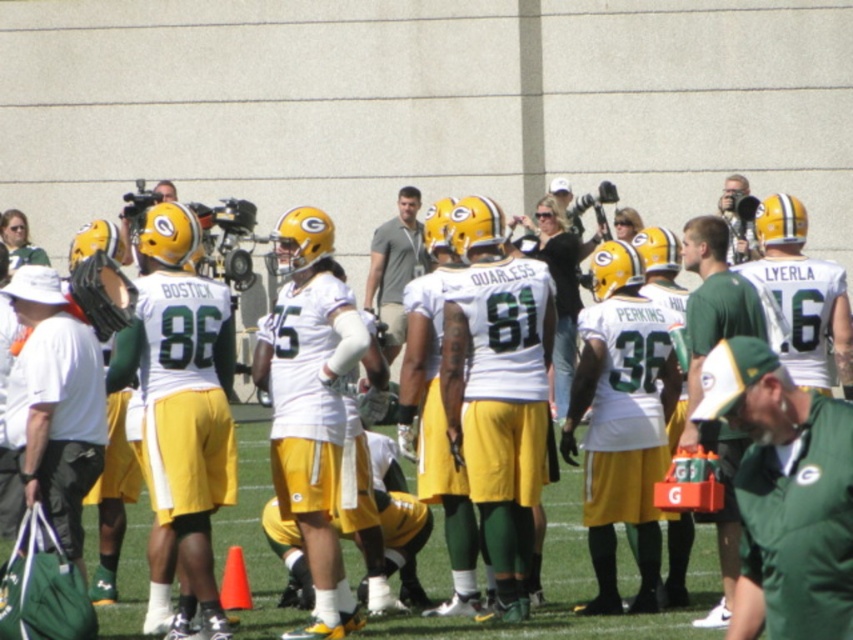
You are a photographer needing to capture a closeup shot of both the green matte helmet at center and the metallic silver camera at upper right. Which object should you zoom in on first to ensure it fits properly in the frame?

The green matte helmet at center occupies less space than the metallic silver camera at upper right, so you should zoom in on the metallic silver camera at upper right first to accommodate its larger size.

You are a photographer positioned at the edge of the field. You want to take a photo of the green matte cap at center. Where should you aim your camera?

You should aim your camera at point [785,493] to capture the green matte cap at center.

Based on the photo, you are a photographer positioned at the edge of the field. You need to take a photo of the green matte helmet at center without the metallic silver camera at upper right appearing in the frame. Is this possible based on their positions?

The green matte helmet at center is to the left of the metallic silver camera at upper right. Since the camera is positioned to the right of the helmet, you can adjust your angle or position to frame the shot so that the metallic silver camera at upper right is out of view while capturing the green matte helmet at center.